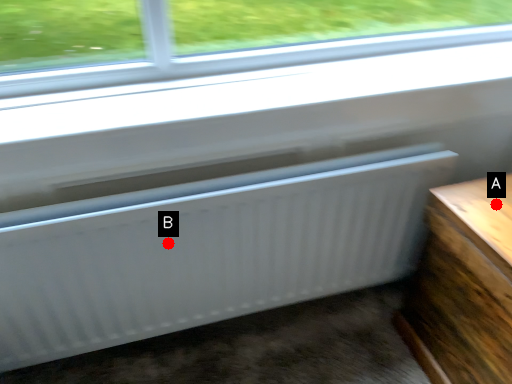
Question: Two points are circled on the image, labeled by A and B beside each circle. Among these points, which one is farthest from the camera?

Choices:
 (A) A is further
 (B) B is further

Answer: (A)